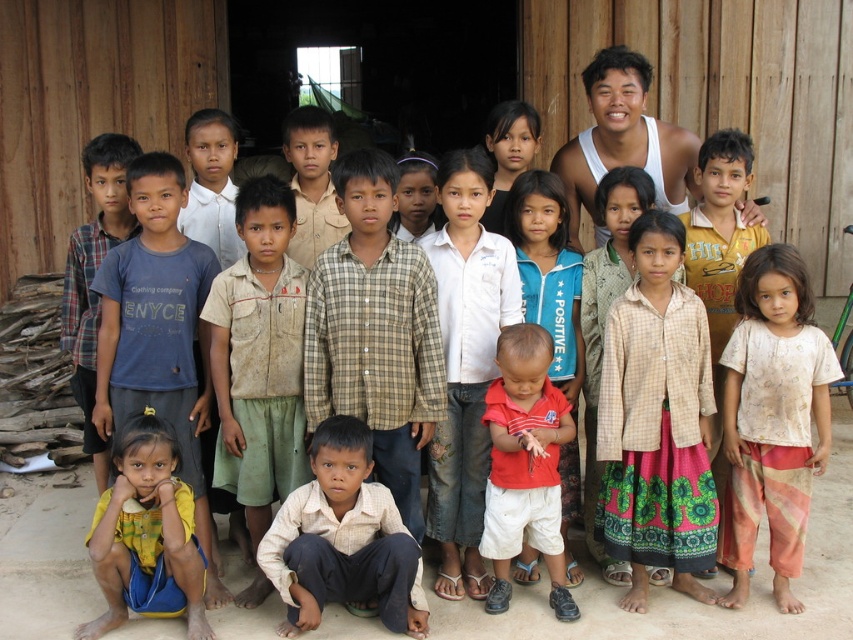
Which is above, light beige printed shirt at lower right or dirty blue shirt at left?

dirty blue shirt at left is above.

Measure the distance between light beige printed shirt at lower right and dirty blue shirt at left.

They are 12.54 feet apart.

Which is in front, point (793, 536) or point (108, 140)?

Positioned in front is point (793, 536).

Find the location of `light beige printed shirt at lower right`. light beige printed shirt at lower right is located at coordinates (772, 419).

Is point (462, 436) positioned in front of point (354, 573)?

No, (462, 436) is further to viewer.

Can you confirm if light brown plaid shirt at center is positioned to the left of light brown cotton shirt at center?

No, light brown plaid shirt at center is not to the left of light brown cotton shirt at center.

Which is behind, point (456, 280) or point (308, 609)?

Point (456, 280)

This screenshot has width=853, height=640. Identify the location of light brown plaid shirt at center. (465, 364).

Is point (447, 438) positioned behind point (526, 241)?

No, (447, 438) is in front of (526, 241).

Is light brown plaid shirt at center to the right of blue fleece jacket at center from the viewer's perspective?

No, light brown plaid shirt at center is not to the right of blue fleece jacket at center.

Between point (502, 326) and point (554, 380), which one is positioned behind?

The point (554, 380) is behind.

At what (x,y) coordinates should I click in order to perform the action: click on light brown plaid shirt at center. Please return your answer as a coordinate pair (x, y). The image size is (853, 640). Looking at the image, I should click on coord(465,364).